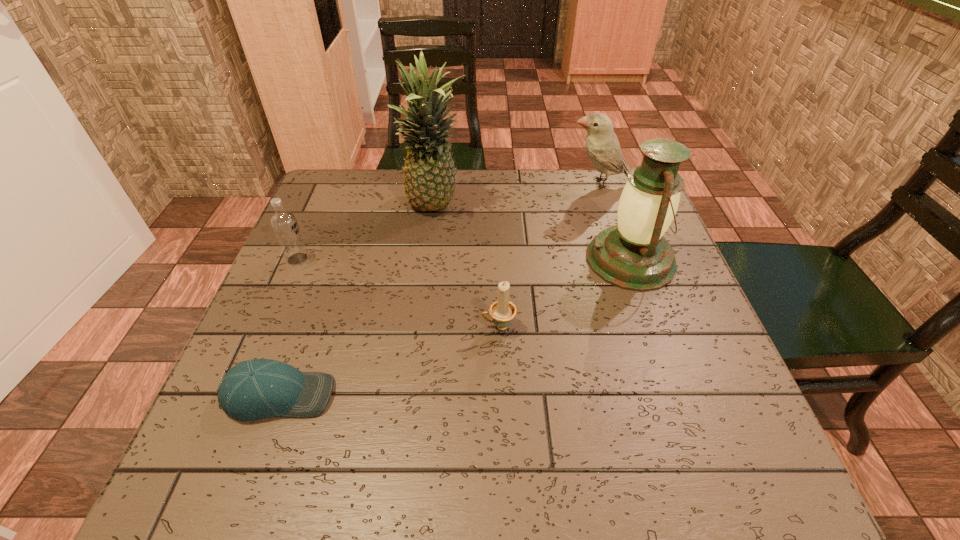
Locate an element on the screen. pineapple is located at coordinates (429, 181).

Locate an element on the screen. The height and width of the screenshot is (540, 960). the tallest object is located at coordinates (429, 181).

Locate an element on the screen. the fifth shortest object is located at coordinates (633, 255).

Find the location of `bird`. bird is located at coordinates click(602, 145).

Where is `the fourth tallest object`? The height and width of the screenshot is (540, 960). the fourth tallest object is located at coordinates (284, 224).

Where is `the fifth farthest object`? The image size is (960, 540). the fifth farthest object is located at coordinates (502, 310).

The image size is (960, 540). In order to click on the fourth object from left to right in this screenshot , I will do `click(502, 310)`.

Identify the location of the shortest object. Image resolution: width=960 pixels, height=540 pixels. (254, 389).

The width and height of the screenshot is (960, 540). In order to click on baseball cap in this screenshot , I will do `click(254, 389)`.

Locate an element on the screen. The height and width of the screenshot is (540, 960). free space located 0.400m on the right of the third object from left to right is located at coordinates (620, 207).